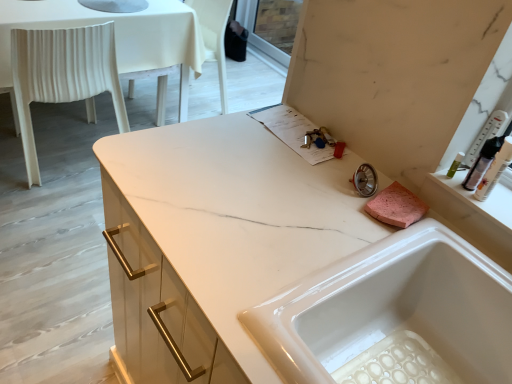
Question: From a real-world perspective, relative to translucent plastic bottle at upper right, is white glossy sink at center vertically above or below?

Choices:
 (A) below
 (B) above

Answer: (A)

Question: Considering the positions of white glossy sink at center and translucent plastic bottle at upper right in the image, is white glossy sink at center wider or thinner than translucent plastic bottle at upper right?

Choices:
 (A) thin
 (B) wide

Answer: (B)

Question: Estimate the real-world distances between objects in this image. Which object is closer to the translucent plastic bottle at upper right?

Choices:
 (A) white glossy sink at center
 (B) white plastic chair at left

Answer: (A)

Question: Considering the real-world distances, which object is farthest from the translucent plastic bottle at upper right?

Choices:
 (A) white plastic chair at left
 (B) white glossy sink at center

Answer: (A)